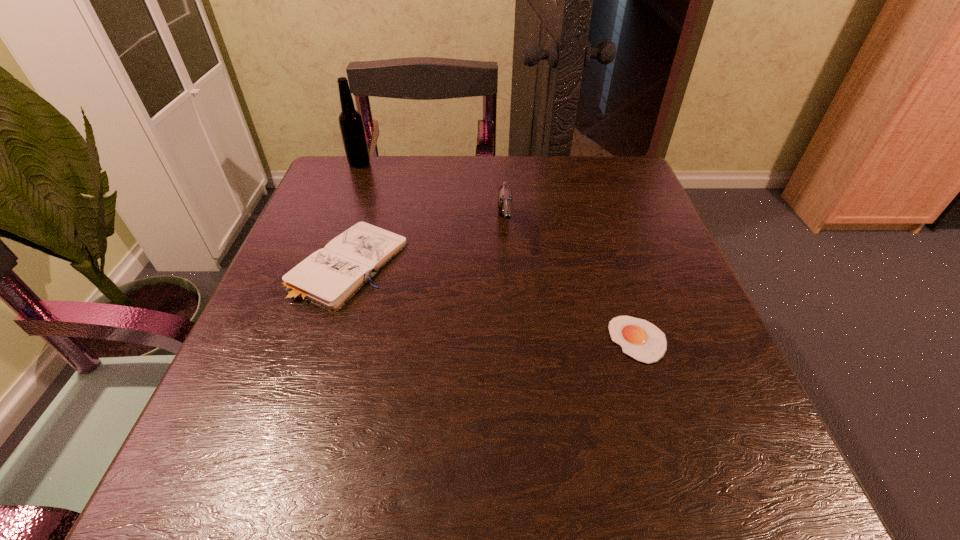
In the image, there is a desktop. Find the location of `free space at the far left corner`. free space at the far left corner is located at coordinates (364, 207).

The height and width of the screenshot is (540, 960). Identify the location of vacant space at the near right corner of the desktop. (751, 448).

Locate an element on the screen. Image resolution: width=960 pixels, height=540 pixels. vacant space that's between the nearest object and the third object from left to right is located at coordinates (571, 284).

Find the location of a particular element. The width and height of the screenshot is (960, 540). free space between the notebook and the beer bottle is located at coordinates (353, 214).

Locate an element on the screen. Image resolution: width=960 pixels, height=540 pixels. vacant area that lies between the farthest object and the third tallest object is located at coordinates (353, 214).

I want to click on vacant area between the tallest object and the egg yolk, so click(499, 252).

Where is `empty location between the second shortest object and the pistol`? empty location between the second shortest object and the pistol is located at coordinates point(426,246).

Where is `vacant region between the beer bottle and the notebook`? This screenshot has width=960, height=540. vacant region between the beer bottle and the notebook is located at coordinates (353, 214).

The image size is (960, 540). I want to click on free space between the shortest object and the second shortest object, so click(493, 302).

You are a GUI agent. You are given a task and a screenshot of the screen. Output one action in this format:
    pyautogui.click(x=<x>, y=<y>)
    Task: Click on the free spot between the notebook and the pistol
    This screenshot has width=960, height=540.
    Given the screenshot: What is the action you would take?
    pyautogui.click(x=426, y=246)